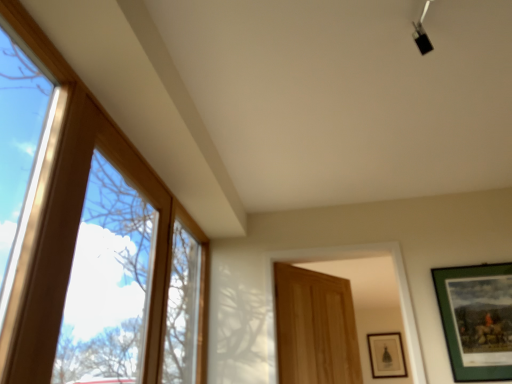
Question: Does wooden door at center have a smaller size compared to green matte picture frame at right, which is the 1th picture frame from top to bottom?

Choices:
 (A) yes
 (B) no

Answer: (B)

Question: Is wooden door at center facing away from green matte picture frame at right, which is the 1th picture frame from top to bottom?

Choices:
 (A) no
 (B) yes

Answer: (A)

Question: Is wooden door at center not close to green matte picture frame at right, acting as the first picture frame starting from the left?

Choices:
 (A) yes
 (B) no

Answer: (B)

Question: Considering the relative sizes of wooden door at center and green matte picture frame at right, which is the 1th picture frame from top to bottom, in the image provided, is wooden door at center bigger than green matte picture frame at right, which is the 1th picture frame from top to bottom,?

Choices:
 (A) yes
 (B) no

Answer: (A)

Question: Would you say wooden door at center contains green matte picture frame at right, which is the 1th picture frame from top to bottom?

Choices:
 (A) no
 (B) yes

Answer: (A)

Question: Is wooden door at center further to camera compared to green matte picture frame at right, which is the 2th picture frame from bottom to top?

Choices:
 (A) no
 (B) yes

Answer: (B)

Question: Is clear glass window at left shorter than green matte picture frame at lower right, the first picture frame from the bottom?

Choices:
 (A) yes
 (B) no

Answer: (B)

Question: Can we say clear glass window at left lies outside green matte picture frame at lower right, the first picture frame from the bottom?

Choices:
 (A) no
 (B) yes

Answer: (B)

Question: Does clear glass window at left have a larger size compared to green matte picture frame at lower right, which is the 2th picture frame in left-to-right order?

Choices:
 (A) yes
 (B) no

Answer: (A)

Question: Considering the relative sizes of clear glass window at left and green matte picture frame at lower right, which is the first picture frame in right-to-left order, in the image provided, is clear glass window at left wider than green matte picture frame at lower right, which is the first picture frame in right-to-left order,?

Choices:
 (A) yes
 (B) no

Answer: (A)

Question: Considering the relative positions of clear glass window at left and green matte picture frame at lower right, which is the first picture frame in right-to-left order, in the image provided, is clear glass window at left in front of green matte picture frame at lower right, which is the first picture frame in right-to-left order,?

Choices:
 (A) no
 (B) yes

Answer: (B)

Question: Is clear glass window at left to the right of green matte picture frame at lower right, acting as the 2th picture frame starting from the top, from the viewer's perspective?

Choices:
 (A) yes
 (B) no

Answer: (B)

Question: Is green matte picture frame at right, which is the 2th picture frame from bottom to top, bigger than wooden door at center?

Choices:
 (A) no
 (B) yes

Answer: (A)